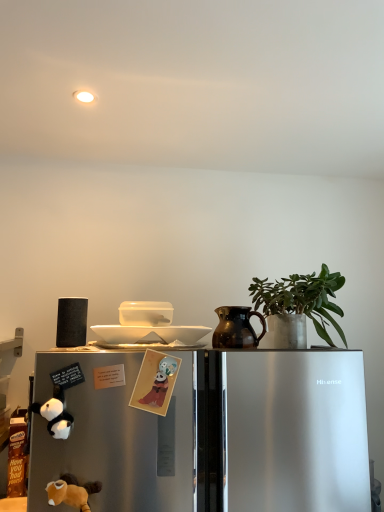
Find the location of a particular element. matte paper card at center, which is counted as the 3th animal, starting from the bottom is located at coordinates (161, 382).

The width and height of the screenshot is (384, 512). Identify the location of brown glazed jug at center. (236, 328).

Where is `green matte plant at upper right`? The height and width of the screenshot is (512, 384). green matte plant at upper right is located at coordinates (302, 298).

Identify the location of sleek metallic refrigerator at lower left. (208, 431).

What is the approximate width of black plush toy at lower left, the 2th animal when ordered from bottom to top?

The width of black plush toy at lower left, the 2th animal when ordered from bottom to top, is 2.25 inches.

Image resolution: width=384 pixels, height=512 pixels. I want to click on white glossy bowl at upper center, which appears as the first appliance when viewed from the right, so click(x=145, y=313).

Is soft plush toy at lower left, which appears as the 2th animal when viewed from the left, beside matte paper card at center, acting as the 1th animal starting from the top?

No, soft plush toy at lower left, which appears as the 2th animal when viewed from the left, is not beside matte paper card at center, acting as the 1th animal starting from the top.

Which is more to the left, soft plush toy at lower left, which appears as the 2th animal when viewed from the left, or matte paper card at center, which appears as the 1th animal when viewed from the right?

Positioned to the left is soft plush toy at lower left, which appears as the 2th animal when viewed from the left.

From the image's perspective, would you say soft plush toy at lower left, which appears as the 2th animal when viewed from the left, is positioned over matte paper card at center, which is counted as the 3th animal, starting from the bottom?

Actually, soft plush toy at lower left, which appears as the 2th animal when viewed from the left, appears below matte paper card at center, which is counted as the 3th animal, starting from the bottom, in the image.

Is sleek metallic refrigerator at lower left located within black matte speaker at left, the 1th appliance in the left-to-right sequence?

That's incorrect, sleek metallic refrigerator at lower left is not inside black matte speaker at left, the 1th appliance in the left-to-right sequence.

Which of these two, black matte speaker at left, acting as the second appliance starting from the right, or sleek metallic refrigerator at lower left, is bigger?

With larger size is sleek metallic refrigerator at lower left.

Can you confirm if black matte speaker at left, the 1th appliance in the left-to-right sequence, is positioned to the left of sleek metallic refrigerator at lower left?

Indeed, black matte speaker at left, the 1th appliance in the left-to-right sequence, is positioned on the left side of sleek metallic refrigerator at lower left.

Considering their positions, is black matte speaker at left, the 1th appliance in the left-to-right sequence, located in front of or behind sleek metallic refrigerator at lower left?

black matte speaker at left, the 1th appliance in the left-to-right sequence, is positioned farther from the viewer than sleek metallic refrigerator at lower left.

Is sleek metallic refrigerator at lower left inside brown glazed jug at center?

No, sleek metallic refrigerator at lower left is not a part of brown glazed jug at center.

From a real-world perspective, is brown glazed jug at center under sleek metallic refrigerator at lower left?

No, from a real-world perspective, brown glazed jug at center is not beneath sleek metallic refrigerator at lower left.

Between brown glazed jug at center and sleek metallic refrigerator at lower left, which one has smaller size?

brown glazed jug at center.

From a real-world perspective, is black matte speaker at left, acting as the second appliance starting from the right, above or below matte paper card at center, which is the third animal in left-to-right order?

In terms of real-world spatial position, black matte speaker at left, acting as the second appliance starting from the right, is above matte paper card at center, which is the third animal in left-to-right order.

Is black matte speaker at left, acting as the second appliance starting from the right, at the left side of matte paper card at center, which is counted as the 3th animal, starting from the bottom?

Indeed, black matte speaker at left, acting as the second appliance starting from the right, is positioned on the left side of matte paper card at center, which is counted as the 3th animal, starting from the bottom.

How distant is black matte speaker at left, the 1th appliance in the left-to-right sequence, from matte paper card at center, which is counted as the 3th animal, starting from the bottom?

13.14 inches.

Is black matte speaker at left, acting as the second appliance starting from the right, touching matte paper card at center, which is the third animal in left-to-right order?

They are not placed beside each other.

Is black plush toy at lower left, the 2th animal positioned from the top, at the left side of sleek metallic refrigerator at lower left?

Yes, black plush toy at lower left, the 2th animal positioned from the top, is to the left of sleek metallic refrigerator at lower left.

Consider the image. Can you tell me how much black plush toy at lower left, the first animal in the left-to-right sequence, and sleek metallic refrigerator at lower left differ in facing direction?

0.00845 degrees.

In order to click on refrigerator that appears in front of the black plush toy at lower left, the 2th animal when ordered from bottom to top in this screenshot , I will do `click(208, 431)`.

Are black plush toy at lower left, acting as the third animal starting from the right, and sleek metallic refrigerator at lower left beside each other?

No, black plush toy at lower left, acting as the third animal starting from the right, is not in contact with sleek metallic refrigerator at lower left.

Considering the relative sizes of matte paper card at center, which is the third animal in left-to-right order, and soft plush toy at lower left, acting as the third animal starting from the top, in the image provided, is matte paper card at center, which is the third animal in left-to-right order, wider than soft plush toy at lower left, acting as the third animal starting from the top,?

In fact, matte paper card at center, which is the third animal in left-to-right order, might be narrower than soft plush toy at lower left, acting as the third animal starting from the top.

In the scene shown: Is matte paper card at center, which is counted as the 3th animal, starting from the bottom, oriented towards soft plush toy at lower left, which appears as the 2th animal when viewed from the left?

No, matte paper card at center, which is counted as the 3th animal, starting from the bottom, is not facing towards soft plush toy at lower left, which appears as the 2th animal when viewed from the left.

From the image's perspective, is matte paper card at center, which appears as the 1th animal when viewed from the right, over soft plush toy at lower left, acting as the third animal starting from the top?

Yes, from the image's perspective, matte paper card at center, which appears as the 1th animal when viewed from the right, is over soft plush toy at lower left, acting as the third animal starting from the top.

From the picture: How different are the orientations of matte paper card at center, which is counted as the 3th animal, starting from the bottom, and soft plush toy at lower left, the 2th animal when ordered from right to left, in degrees?

The facing directions of matte paper card at center, which is counted as the 3th animal, starting from the bottom, and soft plush toy at lower left, the 2th animal when ordered from right to left, are 4.44 degrees apart.

Considering the sizes of objects white glossy bowl at upper center, which appears as the first appliance when viewed from the right, and black matte speaker at left, acting as the second appliance starting from the right, in the image provided, who is bigger, white glossy bowl at upper center, which appears as the first appliance when viewed from the right, or black matte speaker at left, acting as the second appliance starting from the right,?

black matte speaker at left, acting as the second appliance starting from the right.

Is white glossy bowl at upper center, which appears as the first appliance when viewed from the right, next to black matte speaker at left, acting as the second appliance starting from the right?

No, white glossy bowl at upper center, which appears as the first appliance when viewed from the right, is not touching black matte speaker at left, acting as the second appliance starting from the right.

Looking at this image, which object is positioned more to the left, white glossy bowl at upper center, the second appliance when ordered from left to right, or black matte speaker at left, acting as the second appliance starting from the right?

Positioned to the left is black matte speaker at left, acting as the second appliance starting from the right.

Image resolution: width=384 pixels, height=512 pixels. Find the location of `animal that appears on the right of soft plush toy at lower left, acting as the third animal starting from the top`. animal that appears on the right of soft plush toy at lower left, acting as the third animal starting from the top is located at coordinates (161, 382).

This screenshot has height=512, width=384. Find the location of `appliance that is the 2nd one when counting leftward from the sleek metallic refrigerator at lower left`. appliance that is the 2nd one when counting leftward from the sleek metallic refrigerator at lower left is located at coordinates (71, 322).

Consider the image. When comparing their distances from soft plush toy at lower left, the 1th animal from the bottom, does brown glazed jug at center or green matte plant at upper right seem further?

Among the two, green matte plant at upper right is located further to soft plush toy at lower left, the 1th animal from the bottom.

Considering their positions, is brown glazed jug at center positioned closer to green matte plant at upper right than matte paper card at center, which appears as the 1th animal when viewed from the right?

brown glazed jug at center.

From the image, which object appears to be farther from sleek metallic refrigerator at lower left, black matte speaker at left, acting as the second appliance starting from the right, or soft plush toy at lower left, the 2th animal when ordered from right to left?

Among the two, black matte speaker at left, acting as the second appliance starting from the right, is located further to sleek metallic refrigerator at lower left.

Estimate the real-world distances between objects in this image. Which object is closer to sleek metallic refrigerator at lower left, soft plush toy at lower left, acting as the third animal starting from the top, or black matte speaker at left, acting as the second appliance starting from the right?

soft plush toy at lower left, acting as the third animal starting from the top, is positioned closer to the anchor sleek metallic refrigerator at lower left.

Which object lies further to the anchor point green matte plant at upper right, black matte speaker at left, the 1th appliance in the left-to-right sequence, or matte paper card at center, which is the third animal in left-to-right order?

Among the two, black matte speaker at left, the 1th appliance in the left-to-right sequence, is located further to green matte plant at upper right.

When comparing their distances from black matte speaker at left, acting as the second appliance starting from the right, does white glossy bowl at upper center, which appears as the first appliance when viewed from the right, or black plush toy at lower left, acting as the third animal starting from the right, seem closer?

Among the two, white glossy bowl at upper center, which appears as the first appliance when viewed from the right, is located nearer to black matte speaker at left, acting as the second appliance starting from the right.

Looking at the image, which one is located closer to black plush toy at lower left, the first animal in the left-to-right sequence, black matte speaker at left, acting as the second appliance starting from the right, or brown glazed jug at center?

Based on the image, black matte speaker at left, acting as the second appliance starting from the right, appears to be nearer to black plush toy at lower left, the first animal in the left-to-right sequence.

When comparing their distances from sleek metallic refrigerator at lower left, does brown glazed jug at center or green matte plant at upper right seem further?

green matte plant at upper right is positioned further to the anchor sleek metallic refrigerator at lower left.

The width and height of the screenshot is (384, 512). In order to click on appliance between white glossy bowl at upper center, which appears as the first appliance when viewed from the right, and soft plush toy at lower left, acting as the third animal starting from the top, in the vertical direction in this screenshot , I will do `click(71, 322)`.

This screenshot has height=512, width=384. What are the coordinates of `appliance between black plush toy at lower left, the first animal in the left-to-right sequence, and brown glazed jug at center, in the horizontal direction` in the screenshot? It's located at (145, 313).

I want to click on jug between white glossy bowl at upper center, which appears as the first appliance when viewed from the right, and sleek metallic refrigerator at lower left, in the vertical direction, so click(236, 328).

The height and width of the screenshot is (512, 384). I want to click on appliance between black matte speaker at left, the 1th appliance in the left-to-right sequence, and matte paper card at center, which is the third animal in left-to-right order, so click(145, 313).